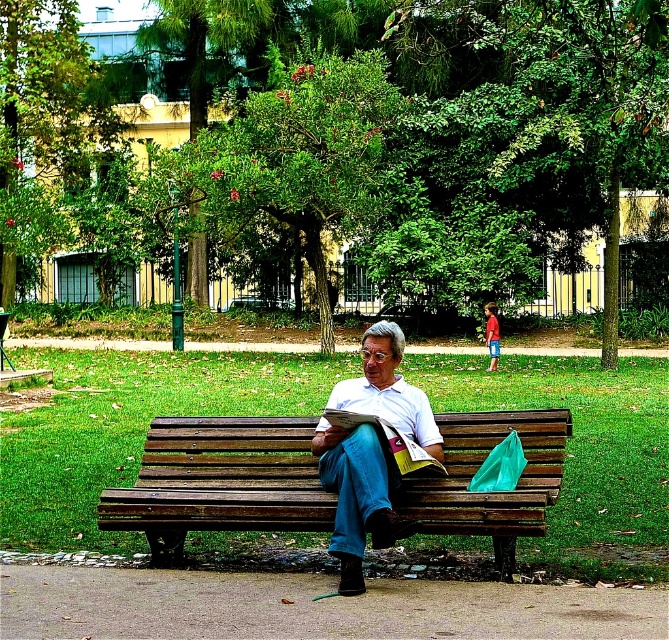
Question: Which of the following is the farthest from the observer?

Choices:
 (A) matte white shirt at center
 (B) white paper book at center
 (C) wooden bench at center

Answer: (C)

Question: Is matte white shirt at center positioned before white paper book at center?

Choices:
 (A) no
 (B) yes

Answer: (B)

Question: Does wooden bench at center have a larger size compared to matte white shirt at center?

Choices:
 (A) yes
 (B) no

Answer: (A)

Question: Which point is closer to the camera?

Choices:
 (A) matte white shirt at center
 (B) wooden bench at center
 (C) white paper book at center

Answer: (A)

Question: Which point is closer to the camera?

Choices:
 (A) (365, 396)
 (B) (286, 497)
 (C) (395, 452)

Answer: (C)

Question: Is matte white shirt at center smaller than white paper book at center?

Choices:
 (A) no
 (B) yes

Answer: (A)